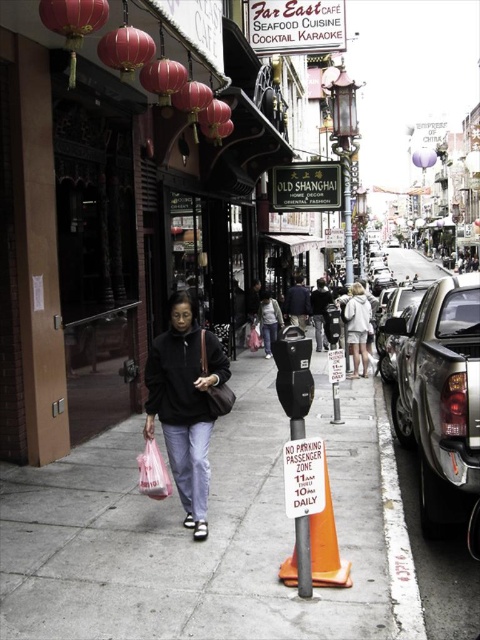
Question: Is gray concrete sidewalk at center closer to the viewer compared to white hoodie at center?

Choices:
 (A) no
 (B) yes

Answer: (B)

Question: Which object is positioned closest to the light gray sweater at center?

Choices:
 (A) matte black jacket at center
 (B) brown leather handbag at center
 (C) white hoodie at center

Answer: (C)

Question: Which is nearer to the gray concrete sidewalk at center?

Choices:
 (A) matte black jacket at center
 (B) dark blue jacket at center

Answer: (A)

Question: Does metallic parking meter at center appear on the left side of black plastic parking meter at center?

Choices:
 (A) no
 (B) yes

Answer: (A)

Question: Which point is farther from the camera taking this photo?

Choices:
 (A) (72, 483)
 (B) (432, 376)

Answer: (A)

Question: Where is black plastic sign at upper center located in relation to white hoodie at center in the image?

Choices:
 (A) below
 (B) above

Answer: (B)